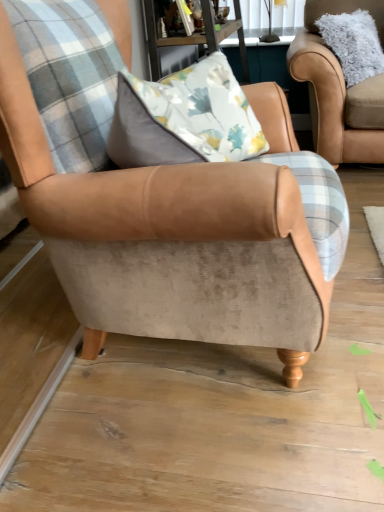
Question: Can you confirm if fuzzy beige armchair at upper right, which is the first chair from back to front, is wider than wooden table at upper center?

Choices:
 (A) yes
 (B) no

Answer: (B)

Question: Is fuzzy beige armchair at upper right, which ranks as the 2th chair in bottom-to-top order, at the right side of wooden table at upper center?

Choices:
 (A) yes
 (B) no

Answer: (A)

Question: Is fuzzy beige armchair at upper right, which is the first chair from back to front, surrounding wooden table at upper center?

Choices:
 (A) no
 (B) yes

Answer: (A)

Question: Considering the relative sizes of fuzzy beige armchair at upper right, which appears as the 1th chair when viewed from the top, and wooden table at upper center in the image provided, is fuzzy beige armchair at upper right, which appears as the 1th chair when viewed from the top, thinner than wooden table at upper center?

Choices:
 (A) yes
 (B) no

Answer: (A)

Question: Considering the relative positions of fuzzy beige armchair at upper right, arranged as the second chair when viewed from the front, and wooden table at upper center in the image provided, is fuzzy beige armchair at upper right, arranged as the second chair when viewed from the front, in front of wooden table at upper center?

Choices:
 (A) yes
 (B) no

Answer: (B)

Question: Is fuzzy beige armchair at upper right, which is counted as the 1th chair, starting from the right, looking in the opposite direction of wooden table at upper center?

Choices:
 (A) no
 (B) yes

Answer: (A)

Question: Can you confirm if suede armchair at center, the first chair in the front-to-back sequence, is shorter than fuzzy beige armchair at upper right, the 2th chair in the left-to-right sequence?

Choices:
 (A) no
 (B) yes

Answer: (A)

Question: Considering the relative positions of suede armchair at center, the 1th chair from the bottom, and fuzzy beige armchair at upper right, which appears as the 1th chair when viewed from the top, in the image provided, is suede armchair at center, the 1th chair from the bottom, to the right of fuzzy beige armchair at upper right, which appears as the 1th chair when viewed from the top, from the viewer's perspective?

Choices:
 (A) yes
 (B) no

Answer: (B)

Question: Is suede armchair at center, the second chair positioned from the right, outside fuzzy beige armchair at upper right, which is counted as the 1th chair, starting from the right?

Choices:
 (A) yes
 (B) no

Answer: (A)

Question: Can you confirm if suede armchair at center, marked as the 1th chair in a left-to-right arrangement, is smaller than fuzzy beige armchair at upper right, which is the first chair from back to front?

Choices:
 (A) no
 (B) yes

Answer: (A)

Question: Can you see suede armchair at center, the second chair positioned from the right, touching fuzzy beige armchair at upper right, which ranks as the 2th chair in bottom-to-top order?

Choices:
 (A) no
 (B) yes

Answer: (A)

Question: Does suede armchair at center, positioned as the second chair in back-to-front order, have a greater width compared to fuzzy beige armchair at upper right, which is counted as the 1th chair, starting from the right?

Choices:
 (A) no
 (B) yes

Answer: (B)

Question: Is wooden table at upper center outside of suede armchair at center, the second chair positioned from the right?

Choices:
 (A) no
 (B) yes

Answer: (B)